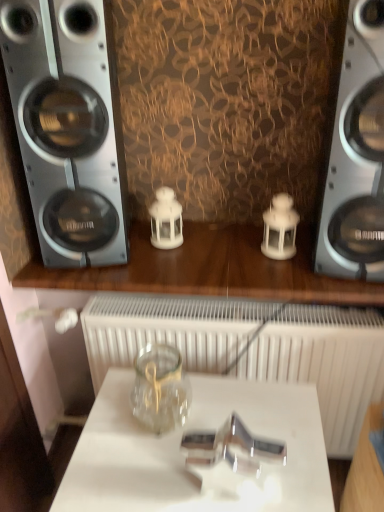
Question: From the image's perspective, is silver metallic speaker at left, placed as the 1th home appliance when sorted from left to right, on top of transparent glass jar at center?

Choices:
 (A) yes
 (B) no

Answer: (A)

Question: From a real-world perspective, does silver metallic speaker at left, placed as the 1th home appliance when sorted from left to right, stand above transparent glass jar at center?

Choices:
 (A) no
 (B) yes

Answer: (B)

Question: Considering the relative sizes of silver metallic speaker at left, which is counted as the 2th home appliance, starting from the right, and transparent glass jar at center in the image provided, is silver metallic speaker at left, which is counted as the 2th home appliance, starting from the right, taller than transparent glass jar at center?

Choices:
 (A) no
 (B) yes

Answer: (B)

Question: Is transparent glass jar at center at the back of silver metallic speaker at left, placed as the 1th home appliance when sorted from left to right?

Choices:
 (A) no
 (B) yes

Answer: (A)

Question: Can you confirm if silver metallic speaker at left, placed as the 1th home appliance when sorted from left to right, is thinner than transparent glass jar at center?

Choices:
 (A) no
 (B) yes

Answer: (A)

Question: Considering their positions, is transparent glass jar at center located in front of or behind silver metallic speaker at left, which is counted as the 2th home appliance, starting from the right?

Choices:
 (A) front
 (B) behind

Answer: (A)

Question: Looking at their shapes, would you say transparent glass jar at center is wider or thinner than silver metallic speaker at left, which is counted as the 2th home appliance, starting from the right?

Choices:
 (A) thin
 (B) wide

Answer: (A)

Question: Is transparent glass jar at center inside or outside of silver metallic speaker at left, which is counted as the 2th home appliance, starting from the right?

Choices:
 (A) inside
 (B) outside

Answer: (B)

Question: From a real-world perspective, is transparent glass jar at center above or below silver metallic speaker at left, placed as the 1th home appliance when sorted from left to right?

Choices:
 (A) above
 (B) below

Answer: (B)

Question: Based on their positions, is transparent glass jar at center located to the left or right of white matte radiator at center?

Choices:
 (A) right
 (B) left

Answer: (B)

Question: Is transparent glass jar at center taller or shorter than white matte radiator at center?

Choices:
 (A) tall
 (B) short

Answer: (B)

Question: Based on their sizes in the image, would you say transparent glass jar at center is bigger or smaller than white matte radiator at center?

Choices:
 (A) small
 (B) big

Answer: (A)

Question: From the image's perspective, relative to white matte radiator at center, is transparent glass jar at center above or below?

Choices:
 (A) below
 (B) above

Answer: (B)

Question: Which is correct: silver metallic speaker at left, placed as the 1th home appliance when sorted from left to right, is inside metallic silver speaker at right, which is the first home appliance from right to left, or outside of it?

Choices:
 (A) outside
 (B) inside

Answer: (A)

Question: Considering the positions of point (119, 159) and point (372, 139), is point (119, 159) closer or farther from the camera than point (372, 139)?

Choices:
 (A) closer
 (B) farther

Answer: (B)